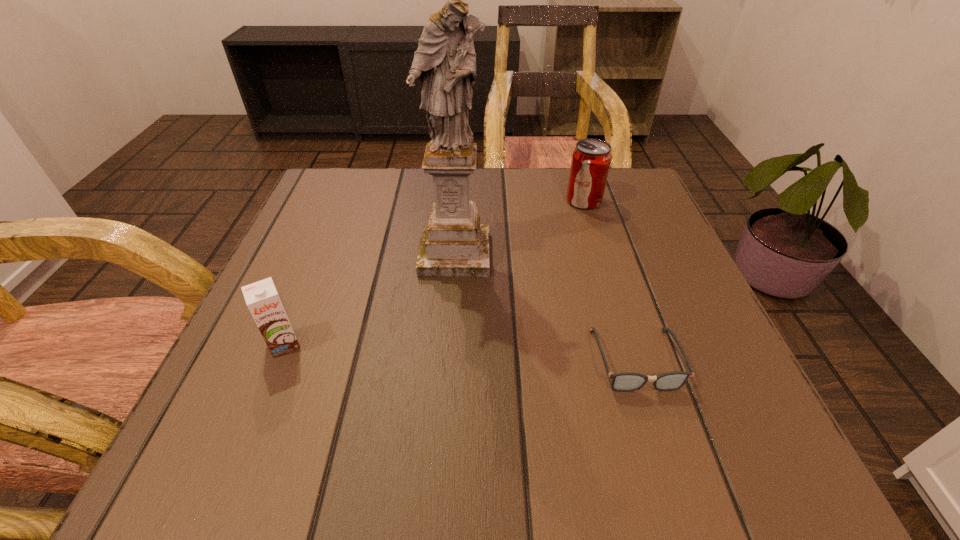
Select which object appears as the second closest to the pop soda. Please provide its 2D coordinates. Your answer should be formatted as a tuple, i.e. [(x, y)], where the tuple contains the x and y coordinates of a point satisfying the conditions above.

[(626, 381)]

Where is `vacant space that satisfies the following two spatial constraints: 1. on the back side of the farthest object; 2. on the left side of the leftmost object`? The image size is (960, 540). vacant space that satisfies the following two spatial constraints: 1. on the back side of the farthest object; 2. on the left side of the leftmost object is located at coordinates (342, 201).